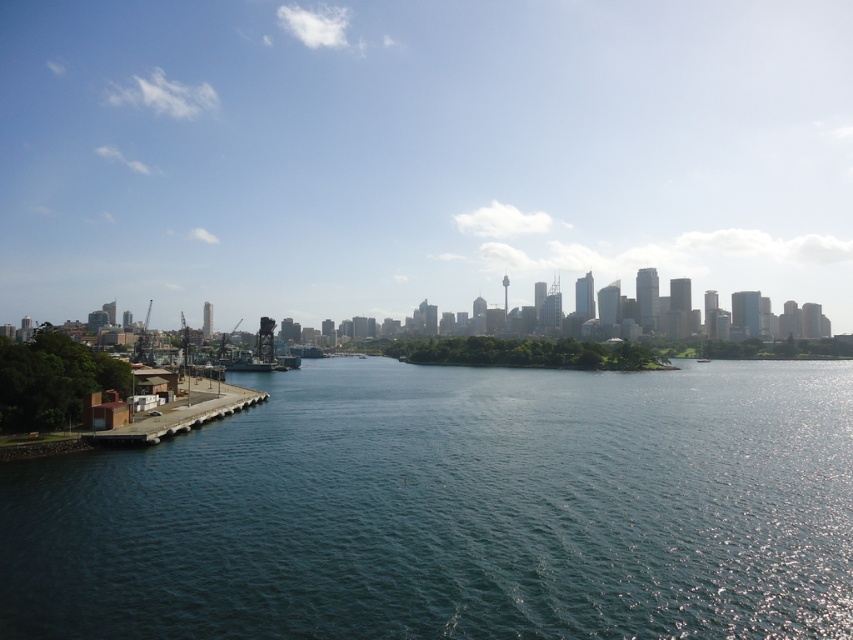
Question: Which object is the closest to the transparent glass skyline at upper center?

Choices:
 (A) brown concrete dock at lower left
 (B) dark blue water at center

Answer: (B)

Question: Is transparent glass skyline at upper center positioned in front of dark blue water at center?

Choices:
 (A) yes
 (B) no

Answer: (B)

Question: Does transparent glass skyline at upper center appear on the right side of dark blue water at center?

Choices:
 (A) yes
 (B) no

Answer: (B)

Question: Which point is closer to the camera?

Choices:
 (A) (155, 420)
 (B) (471, 486)
 (C) (457, 54)

Answer: (B)

Question: Is transparent glass skyline at upper center behind dark blue water at center?

Choices:
 (A) yes
 (B) no

Answer: (A)

Question: Which point appears closest to the camera in this image?

Choices:
 (A) (158, 422)
 (B) (514, 116)

Answer: (A)